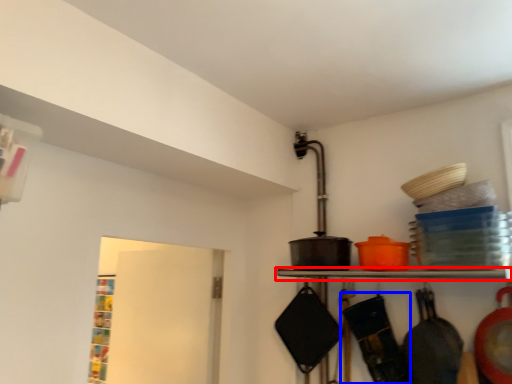
Question: Which of the following is the farthest to the observer, shelf (highlighted by a red box) or frying pan (highlighted by a blue box)?

Choices:
 (A) shelf
 (B) frying pan

Answer: (B)